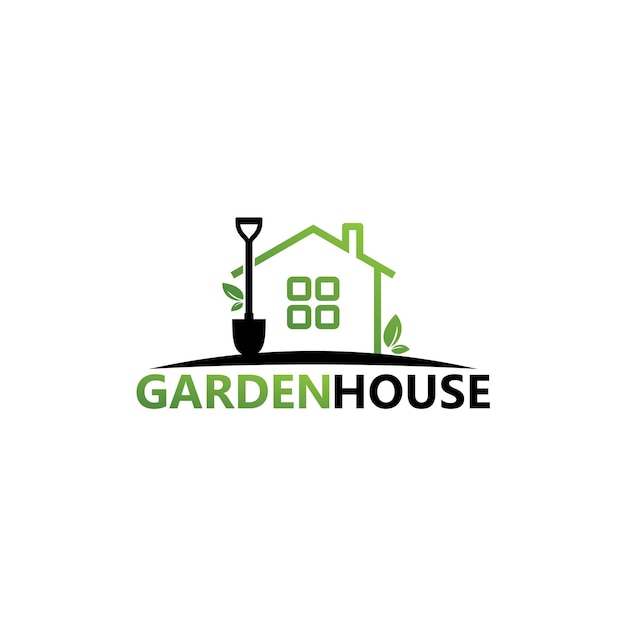
What are the coordinates of `handle` in the screenshot? It's located at (240, 220).